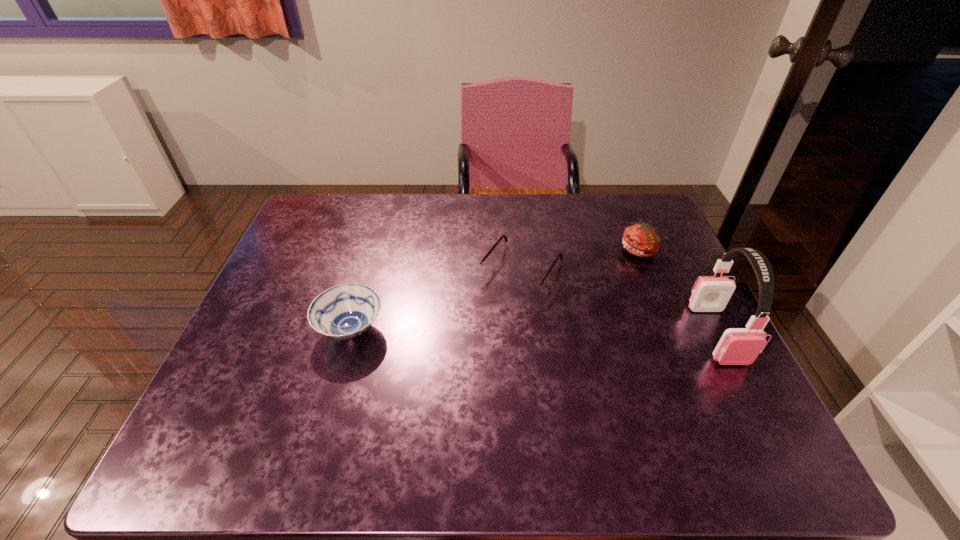
Locate an element on the screen. The image size is (960, 540). the third tallest object is located at coordinates (345, 311).

Identify the location of soup bowl. This screenshot has height=540, width=960. (345, 311).

Identify the location of the tallest object. Image resolution: width=960 pixels, height=540 pixels. (738, 346).

This screenshot has width=960, height=540. In order to click on the second tallest object in this screenshot , I will do [x=641, y=239].

Find the location of a particular element. the second object from left to right is located at coordinates tap(528, 287).

The image size is (960, 540). I want to click on spectacles, so click(528, 287).

The height and width of the screenshot is (540, 960). Identify the location of blank area located 0.130m on the back of the leftmost object. (368, 270).

Where is `vacant region located on the outer surface of the earphone`? The width and height of the screenshot is (960, 540). vacant region located on the outer surface of the earphone is located at coordinates (758, 416).

Where is `vacant region located 0.390m on the front-facing side of the second tallest object`? Image resolution: width=960 pixels, height=540 pixels. vacant region located 0.390m on the front-facing side of the second tallest object is located at coordinates (553, 346).

Locate an element on the screen. The image size is (960, 540). vacant space located 0.380m on the front-facing side of the second tallest object is located at coordinates (555, 343).